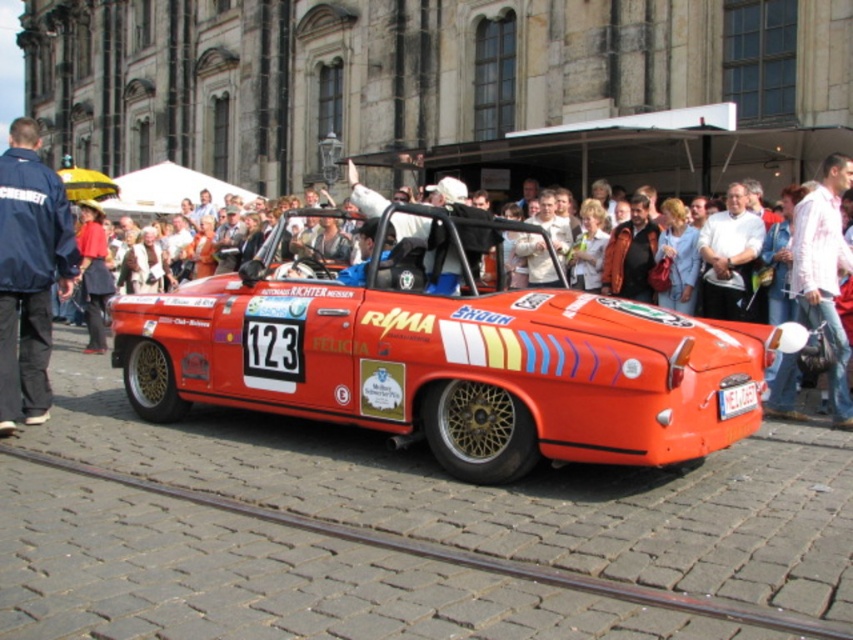
Question: Can you confirm if white shirt at center is smaller than yellow plastic license plate at center?

Choices:
 (A) no
 (B) yes

Answer: (A)

Question: Which object appears closest to the camera in this image?

Choices:
 (A) blue jacket at left
 (B) white shirt at center

Answer: (A)

Question: Which point appears farthest from the camera in this image?

Choices:
 (A) (735, 410)
 (B) (10, 408)
 (C) (822, 179)

Answer: (C)

Question: Which object is closer to the camera taking this photo?

Choices:
 (A) shiny orange car at center
 (B) yellow plastic license plate at center
 (C) blue jacket at left

Answer: (A)

Question: Is blue jacket at left bigger than white shirt at center?

Choices:
 (A) no
 (B) yes

Answer: (B)

Question: Does shiny orange car at center have a larger size compared to white shirt at center?

Choices:
 (A) no
 (B) yes

Answer: (B)